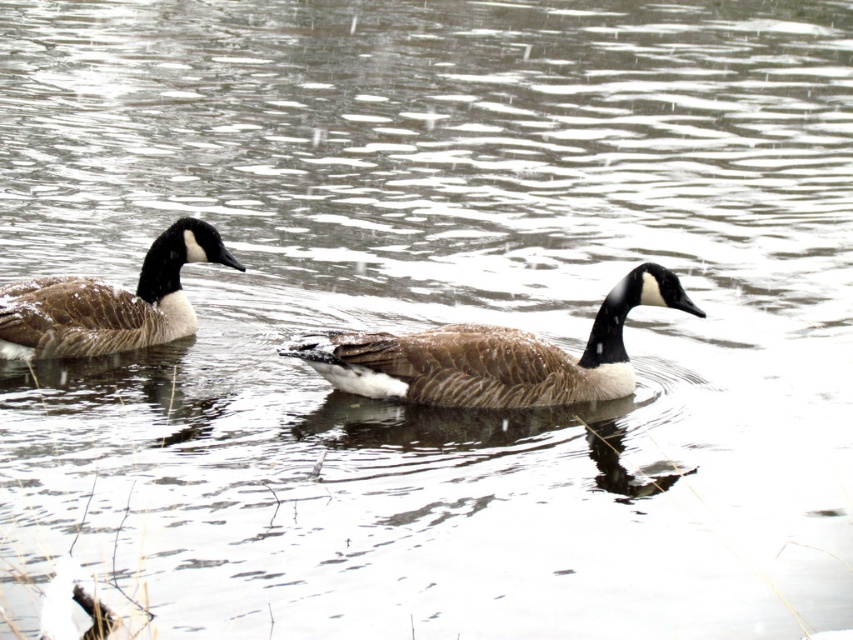
You are standing on the shore observing two brown feathered ducks swimming on the water. You notice one is at the center and the other is on the left. Which duck is closer to you, the brown feathered duck at center or the brown feathered duck at left?

The brown feathered duck at center is closer to you because it is in front of the brown feathered duck at left.

You are standing on the shore of the lake and see two Canada geese swimming in the water. The first goose is at point (517, 400). You want to throw a bread roll to the goose that is farther from the shore. Which goose should you target?

The second goose is farther from the shore because the distance between them is 22.76 feet, so the one farther from the shore would be the one not at point (517, 400).